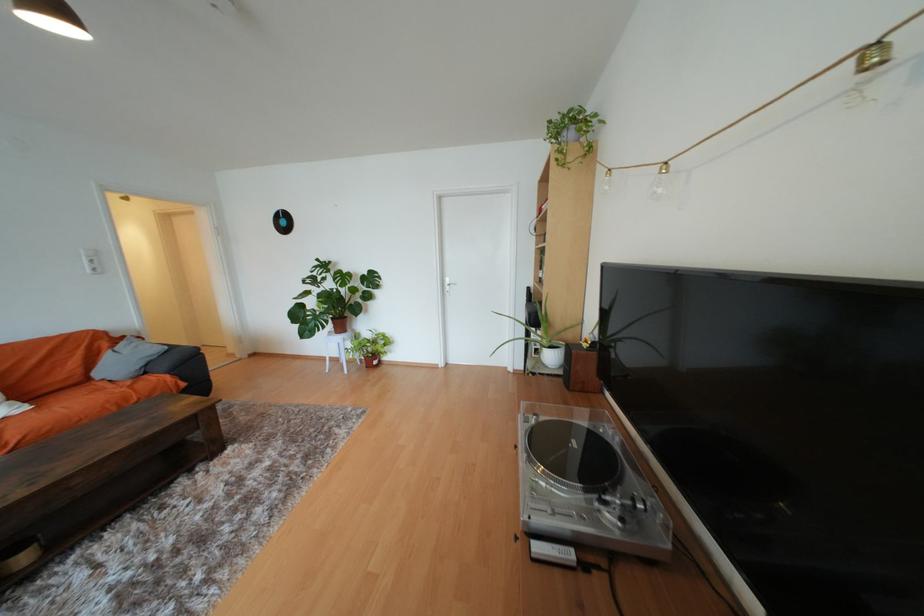
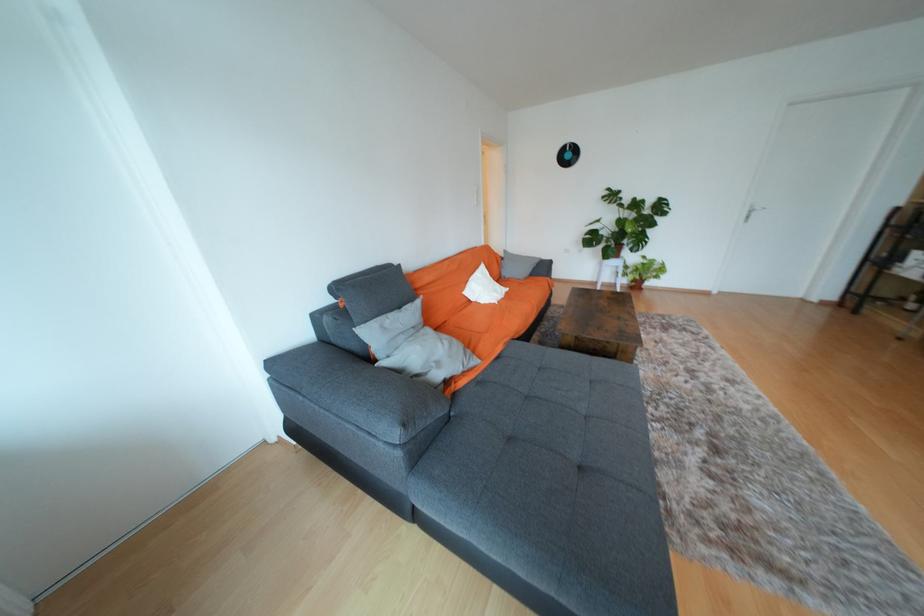
The point at (289,224) is marked in the first image. Where is the corresponding point in the second image?

(574, 156)